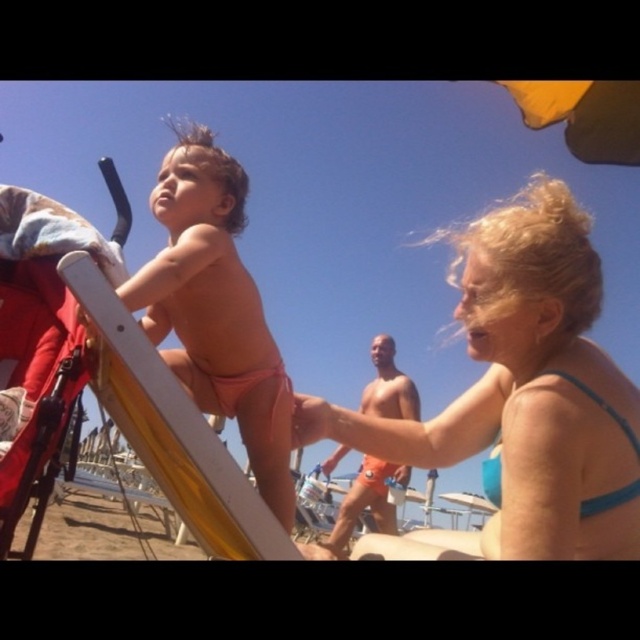
Is pink matte swimsuit at center below orange fabric shorts at center?

No.

Where is `pink matte swimsuit at center`? The image size is (640, 640). pink matte swimsuit at center is located at coordinates (216, 307).

The width and height of the screenshot is (640, 640). I want to click on pink matte swimsuit at center, so click(216, 307).

Is point (547, 330) in front of point (326, 467)?

Yes, point (547, 330) is in front of point (326, 467).

Between blue fabric bikini top at upper right and orange fabric shorts at center, which one is positioned higher?

blue fabric bikini top at upper right

In the scene shown: Who is more forward, (452, 541) or (381, 512)?

Point (452, 541) is more forward.

At what (x,y) coordinates should I click in order to perform the action: click on blue fabric bikini top at upper right. Please return your answer as a coordinate pair (x, y). The width and height of the screenshot is (640, 640). Looking at the image, I should click on (518, 397).

Is point (483, 236) more distant than point (163, 336)?

No, (483, 236) is closer to viewer.

Is point (465, 452) positioned in front of point (228, 317)?

Yes, it is.

Who is more forward, (x=417, y=541) or (x=289, y=474)?

Positioned in front is point (x=417, y=541).

Where is `blue fabric bikini top at upper right`? blue fabric bikini top at upper right is located at coordinates (518, 397).